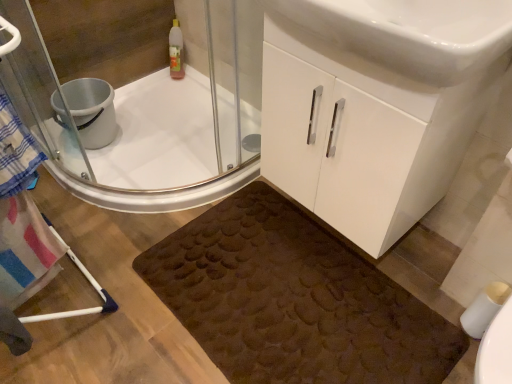
At what (x,y) coordinates should I click in order to perform the action: click on vacant area situated to the left side of clear glass shower door at upper left. Please return your answer as a coordinate pair (x, y). Looking at the image, I should click on (156, 163).